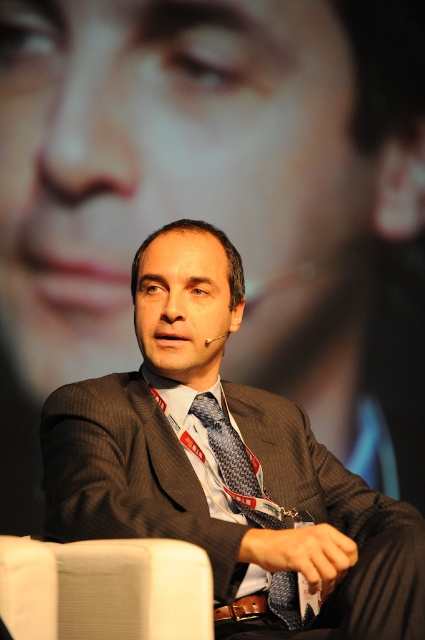
Is matte gray suit at center shorter than white fabric chair at lower left?

In fact, matte gray suit at center may be taller than white fabric chair at lower left.

What do you see at coordinates (226, 467) in the screenshot? This screenshot has height=640, width=425. I see `matte gray suit at center` at bounding box center [226, 467].

This screenshot has height=640, width=425. What are the coordinates of `matte gray suit at center` in the screenshot? It's located at (226, 467).

Is white fabric chair at lower left below patterned silk tie at center?

Correct, white fabric chair at lower left is located below patterned silk tie at center.

Who is more forward, (76, 636) or (283, 525)?

Point (76, 636) is more forward.

Image resolution: width=425 pixels, height=640 pixels. I want to click on white fabric chair at lower left, so click(x=104, y=589).

Can you confirm if matte gray suit at center is positioned above patterned silk tie at center?

Yes.

Does point (238, 420) come closer to viewer compared to point (252, 515)?

No, it is not.

Measure the distance between matte gray suit at center and camera.

matte gray suit at center and camera are 1.10 meters apart from each other.

At what (x,y) coordinates should I click in order to perform the action: click on matte gray suit at center. Please return your answer as a coordinate pair (x, y). The height and width of the screenshot is (640, 425). Looking at the image, I should click on (226, 467).